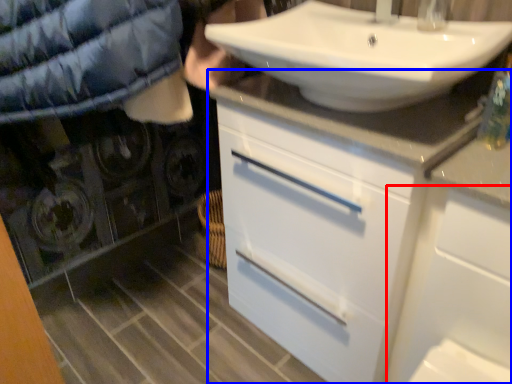
Question: Which object is closer to the camera taking this photo, cabinetry (highlighted by a red box) or bathroom cabinet (highlighted by a blue box)?

Choices:
 (A) cabinetry
 (B) bathroom cabinet

Answer: (A)